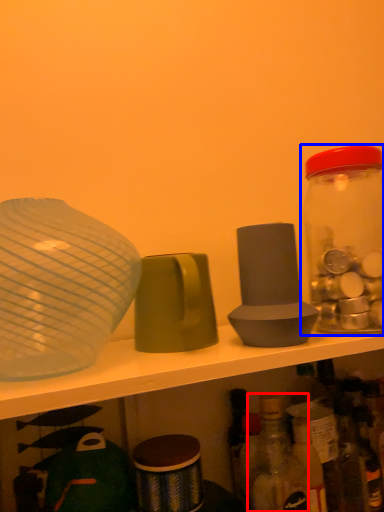
Question: Which of the following is the closest to the observer, bottle (highlighted by a red box) or bottle (highlighted by a blue box)?

Choices:
 (A) bottle
 (B) bottle

Answer: (A)